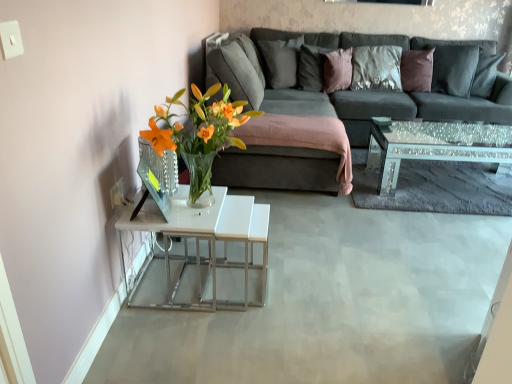
Question: From the image's perspective, is pink velvet pillow at upper center, placed as the 2th pillow when sorted from left to right, above or below dark gray fabric couch at center?

Choices:
 (A) above
 (B) below

Answer: (A)

Question: Considering the positions of point (315, 46) and point (215, 79), is point (315, 46) closer or farther from the camera than point (215, 79)?

Choices:
 (A) closer
 (B) farther

Answer: (B)

Question: Which object is positioned closest to the dark gray fabric couch at center?

Choices:
 (A) pink velvet pillow at upper center, which appears as the second pillow when viewed from the right
 (B) mirrored glass coffee table at right
 (C) pink velvet pillow at upper center, positioned as the first pillow in right-to-left order
 (D) velvet gray pillow at upper center, which appears as the third pillow when viewed from the right

Answer: (A)

Question: Considering the real-world distances, which object is farthest from the dark gray fabric couch at center?

Choices:
 (A) pink velvet pillow at upper center, which appears as the second pillow when viewed from the right
 (B) velvet gray pillow at upper center, the 1th pillow positioned from the left
 (C) mirrored glass coffee table at right
 (D) pink velvet pillow at upper center, the third pillow viewed from the left

Answer: (C)